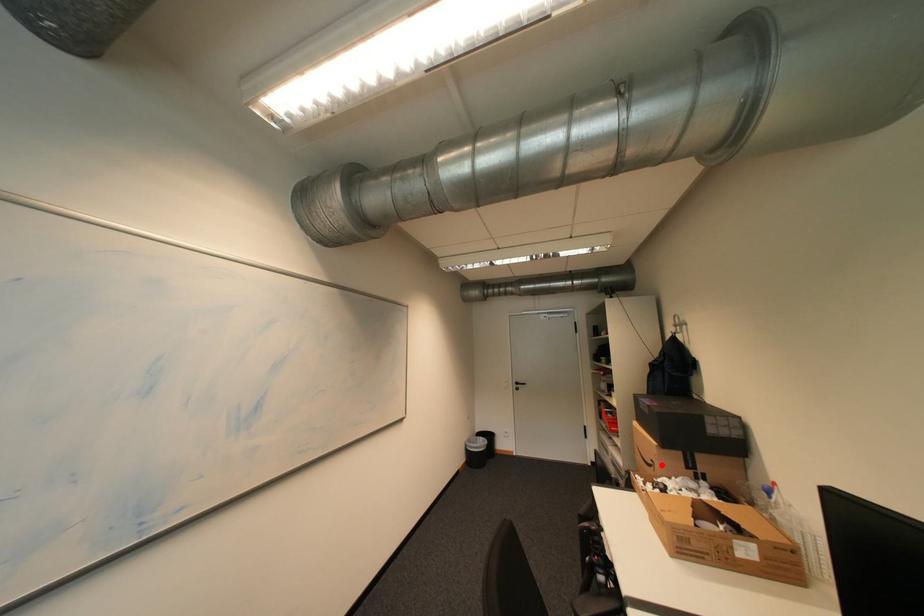
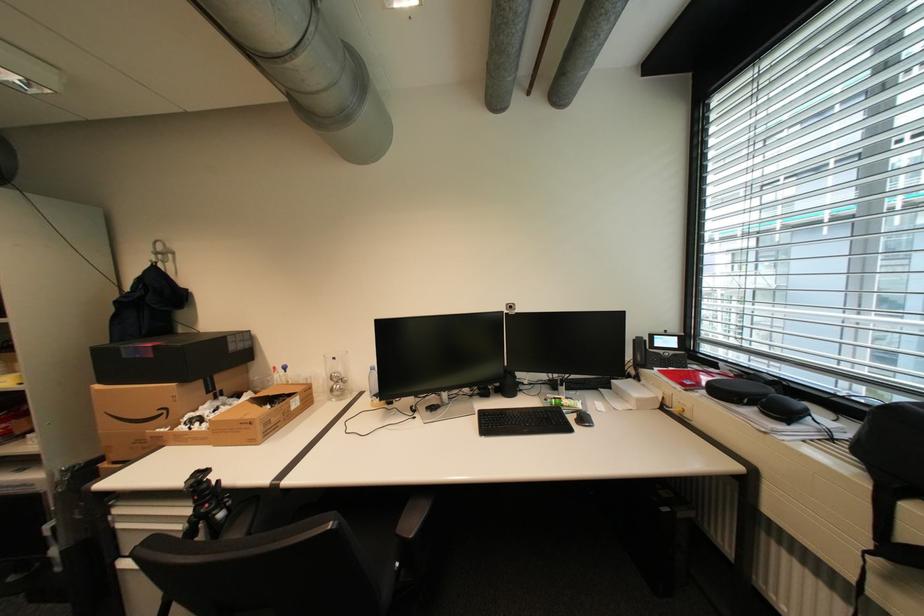
In the second image, find the point that corresponds to the highlighted location in the first image.

(174, 411)